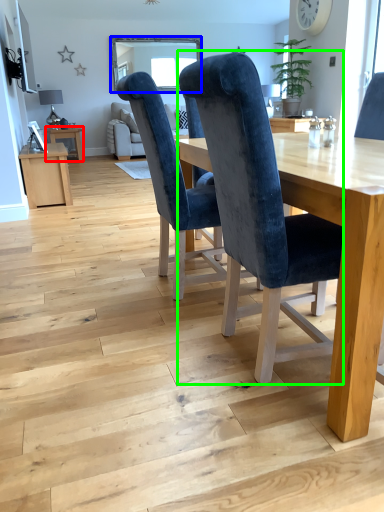
Question: Which is nearer to the table (highlighted by a red box)? window screen (highlighted by a blue box) or chair (highlighted by a green box).

Choices:
 (A) window screen
 (B) chair

Answer: (A)